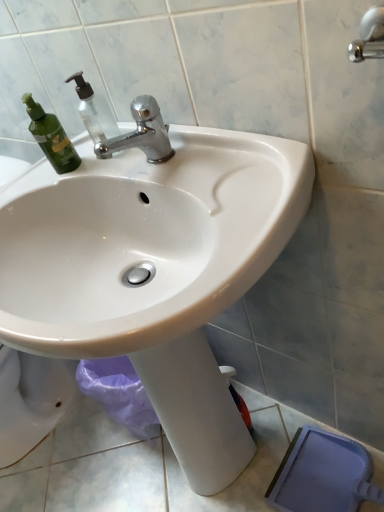
Question: Should I look upward or downward to see transparent plastic soap dispenser at upper left?

Choices:
 (A) down
 (B) up

Answer: (B)

Question: Considering the relative sizes of white glossy sink at center and transparent plastic soap dispenser at upper left in the image provided, is white glossy sink at center bigger than transparent plastic soap dispenser at upper left?

Choices:
 (A) no
 (B) yes

Answer: (B)

Question: Is white glossy sink at center facing towards transparent plastic soap dispenser at upper left?

Choices:
 (A) yes
 (B) no

Answer: (B)

Question: Can you confirm if white glossy sink at center is wider than transparent plastic soap dispenser at upper left?

Choices:
 (A) no
 (B) yes

Answer: (B)

Question: Does white glossy sink at center come behind transparent plastic soap dispenser at upper left?

Choices:
 (A) yes
 (B) no

Answer: (B)

Question: From the image's perspective, does white glossy sink at center appear higher than transparent plastic soap dispenser at upper left?

Choices:
 (A) yes
 (B) no

Answer: (B)

Question: Considering the relative positions of white glossy sink at center and transparent plastic soap dispenser at upper left in the image provided, is white glossy sink at center in front of transparent plastic soap dispenser at upper left?

Choices:
 (A) no
 (B) yes

Answer: (B)

Question: Can you confirm if transparent plastic soap dispenser at upper left is taller than white glossy sink at center?

Choices:
 (A) yes
 (B) no

Answer: (B)

Question: From the image's perspective, is transparent plastic soap dispenser at upper left on top of white glossy sink at center?

Choices:
 (A) yes
 (B) no

Answer: (A)

Question: Are transparent plastic soap dispenser at upper left and white glossy sink at center far apart?

Choices:
 (A) no
 (B) yes

Answer: (A)

Question: From a real-world perspective, does transparent plastic soap dispenser at upper left stand above white glossy sink at center?

Choices:
 (A) yes
 (B) no

Answer: (A)

Question: Can you confirm if transparent plastic soap dispenser at upper left is thinner than white glossy sink at center?

Choices:
 (A) yes
 (B) no

Answer: (A)

Question: Is transparent plastic soap dispenser at upper left facing away from white glossy sink at center?

Choices:
 (A) no
 (B) yes

Answer: (A)

Question: Are white glossy sink at center and polished chrome faucet at upper center making contact?

Choices:
 (A) yes
 (B) no

Answer: (B)